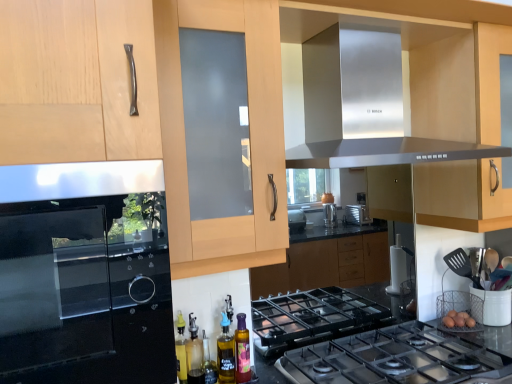
Question: Is stainless steel exhaust hood at upper center taller than matte wood cabinet at center?

Choices:
 (A) no
 (B) yes

Answer: (A)

Question: Is matte wood cabinet at center located within stainless steel exhaust hood at upper center?

Choices:
 (A) no
 (B) yes

Answer: (A)

Question: From a real-world perspective, is stainless steel exhaust hood at upper center on matte wood cabinet at center?

Choices:
 (A) no
 (B) yes

Answer: (B)

Question: Could you tell me if stainless steel exhaust hood at upper center is facing matte wood cabinet at center?

Choices:
 (A) no
 (B) yes

Answer: (B)

Question: From the image's perspective, is stainless steel exhaust hood at upper center located beneath matte wood cabinet at center?

Choices:
 (A) yes
 (B) no

Answer: (B)

Question: From a real-world perspective, is stainless steel exhaust hood at upper center beneath matte wood cabinet at center?

Choices:
 (A) yes
 (B) no

Answer: (B)

Question: Does polished stainless steel gas stove at center come in front of satin black oven at left?

Choices:
 (A) no
 (B) yes

Answer: (A)

Question: Can you confirm if polished stainless steel gas stove at center is bigger than satin black oven at left?

Choices:
 (A) no
 (B) yes

Answer: (A)

Question: Can we say polished stainless steel gas stove at center lies outside satin black oven at left?

Choices:
 (A) yes
 (B) no

Answer: (A)

Question: From a real-world perspective, is polished stainless steel gas stove at center physically below satin black oven at left?

Choices:
 (A) no
 (B) yes

Answer: (B)

Question: Can you see polished stainless steel gas stove at center touching satin black oven at left?

Choices:
 (A) no
 (B) yes

Answer: (A)

Question: From the image's perspective, is polished stainless steel gas stove at center over satin black oven at left?

Choices:
 (A) yes
 (B) no

Answer: (B)

Question: Could you tell me if polished stainless steel gas stove at center is facing stainless steel exhaust hood at upper center?

Choices:
 (A) yes
 (B) no

Answer: (B)